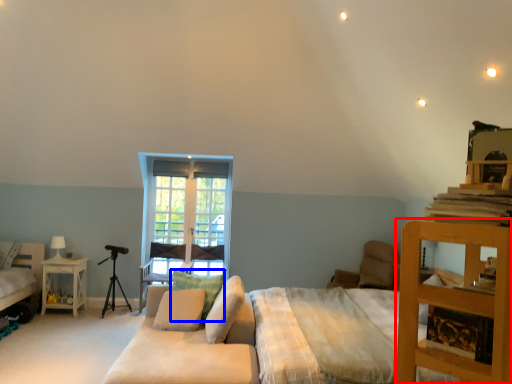
Question: Which object appears farthest to the camera in this image, computer desk (highlighted by a red box) or pillow (highlighted by a blue box)?

Choices:
 (A) computer desk
 (B) pillow

Answer: (B)